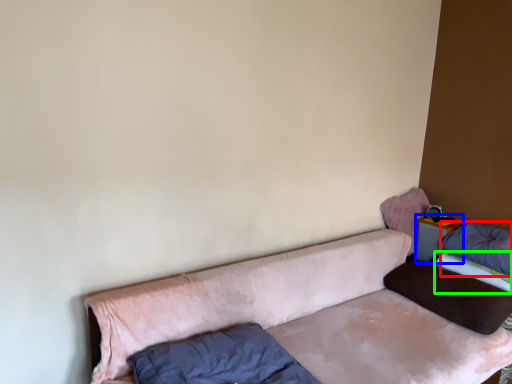
Question: Estimate the real-world distances between objects in this image. Which object is farther from pillow (highlighted by a red box), table (highlighted by a blue box) or mattress (highlighted by a green box)?

Choices:
 (A) table
 (B) mattress

Answer: (A)